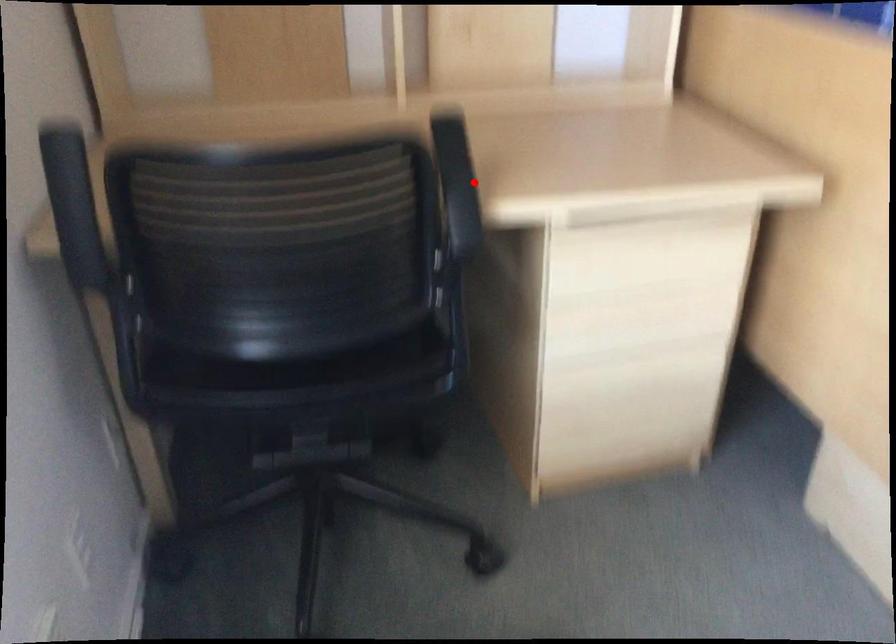
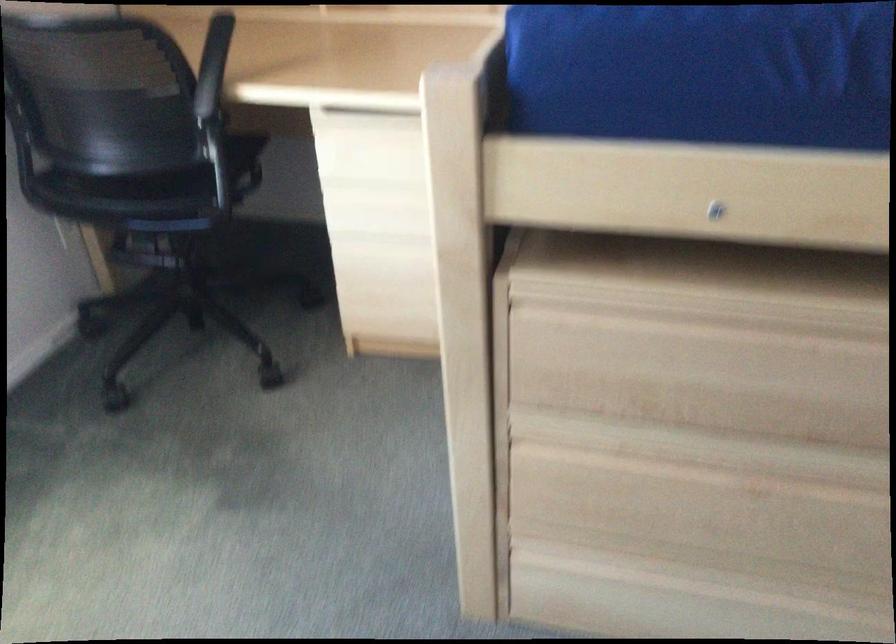
Question: I am providing you with two images of the same scene from different viewpoints. In image1, a red point is highlighted. Considering the same 3D point in image2, which of the following is correct?

Choices:
 (A) It is closer
 (B) It is farther

Answer: (B)